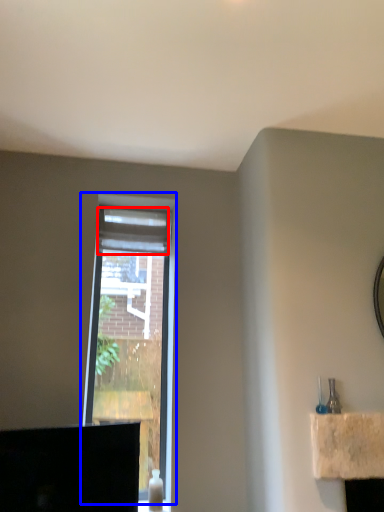
Question: Which object is further to the camera taking this photo, curtain (highlighted by a red box) or window (highlighted by a blue box)?

Choices:
 (A) curtain
 (B) window

Answer: (A)